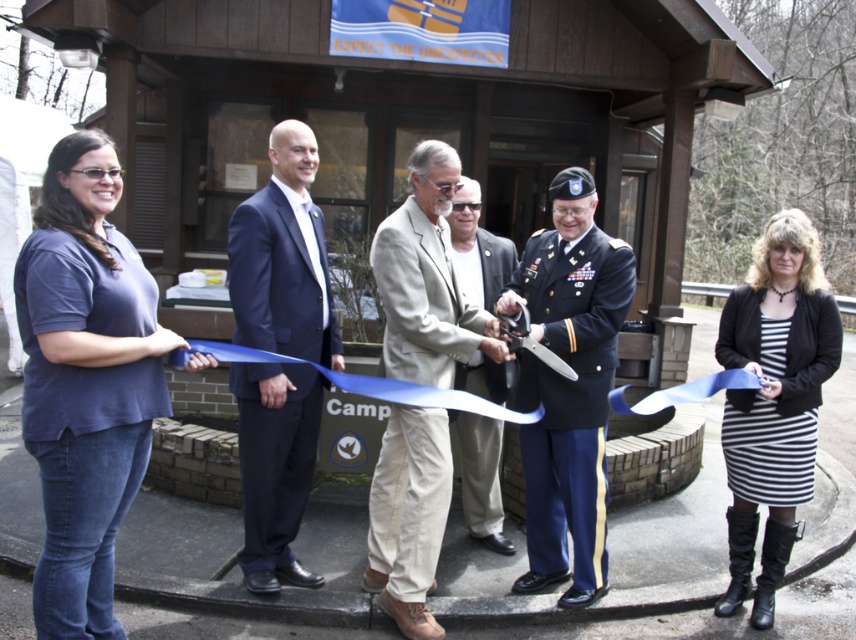
Can you confirm if matte blue shirt at left is positioned above light brown leather jacket at center?

Correct, matte blue shirt at left is located above light brown leather jacket at center.

Between matte blue shirt at left and light brown leather jacket at center, which one is positioned lower?

light brown leather jacket at center

Which is behind, point (114, 424) or point (484, 524)?

Point (484, 524)

This screenshot has width=856, height=640. Identify the location of matte blue shirt at left. (85, 381).

Is matte blue shirt at left further to the viewer compared to blue satin ribbon at center?

That is False.

Is matte blue shirt at left taller than blue satin ribbon at center?

Indeed, matte blue shirt at left has a greater height compared to blue satin ribbon at center.

Is point (16, 300) positioned before point (714, 384)?

Yes, point (16, 300) is in front of point (714, 384).

The image size is (856, 640). Identify the location of matte blue shirt at left. click(x=85, y=381).

Is the position of navy blue suit at center less distant than that of blue satin ribbon at center?

No, navy blue suit at center is behind blue satin ribbon at center.

Between navy blue suit at center and blue satin ribbon at center, which one appears on the left side from the viewer's perspective?

navy blue suit at center

Where is `navy blue suit at center`? The image size is (856, 640). navy blue suit at center is located at coordinates (283, 259).